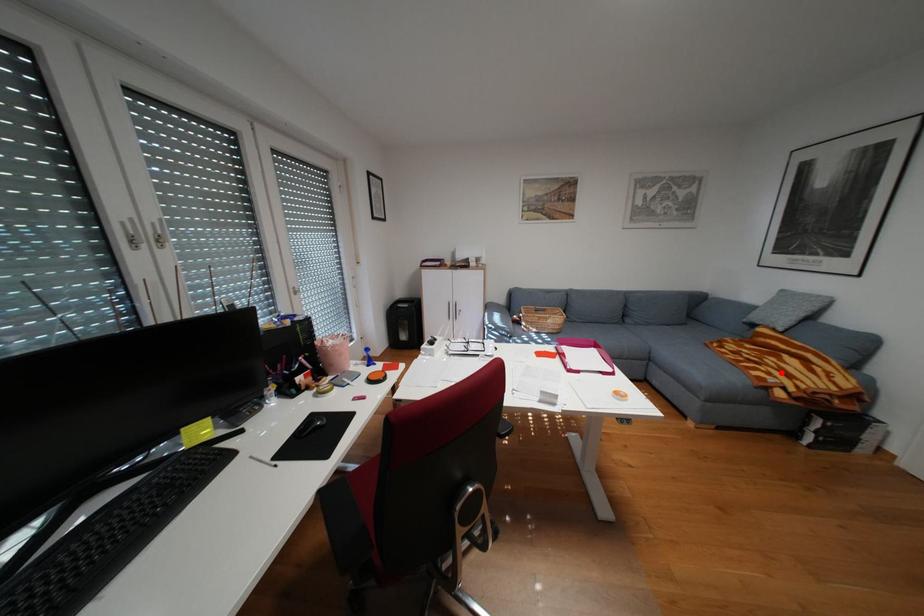
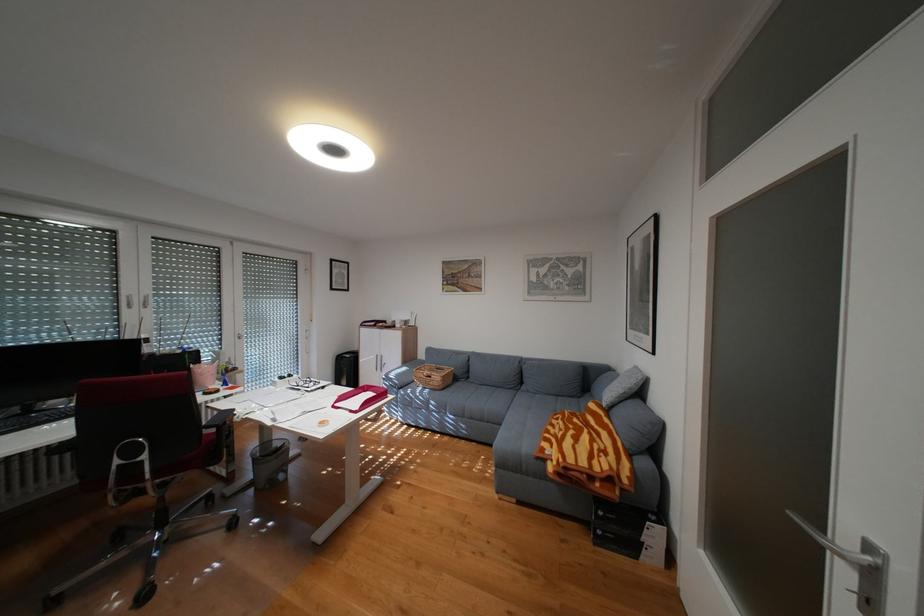
Find the pixel in the second image that matches the highlighted location in the first image.

(564, 445)